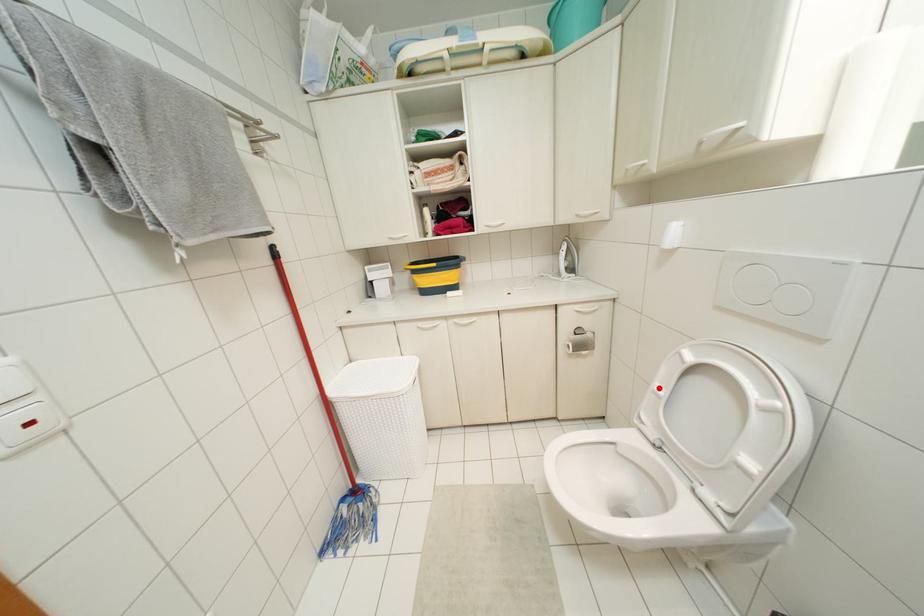
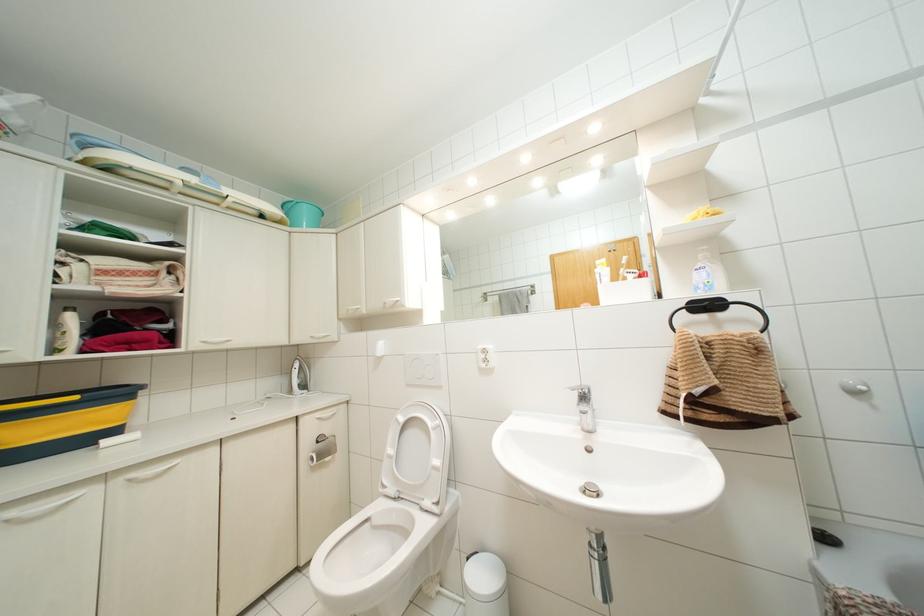
Find the pixel in the second image that matches the highlighted location in the first image.

(390, 450)